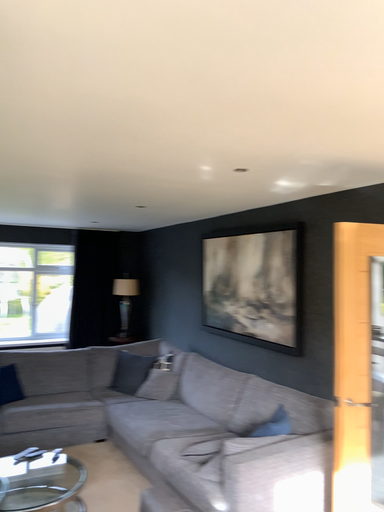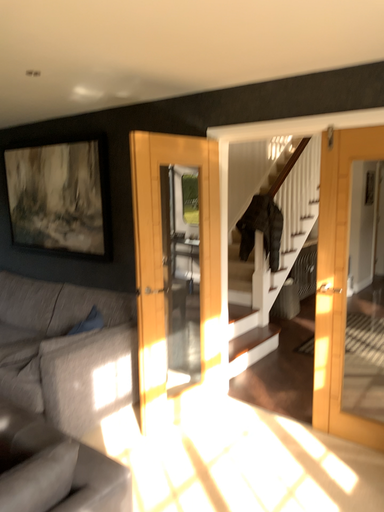
Question: Which way did the camera rotate in the video?

Choices:
 (A) rotated left
 (B) rotated right

Answer: (B)